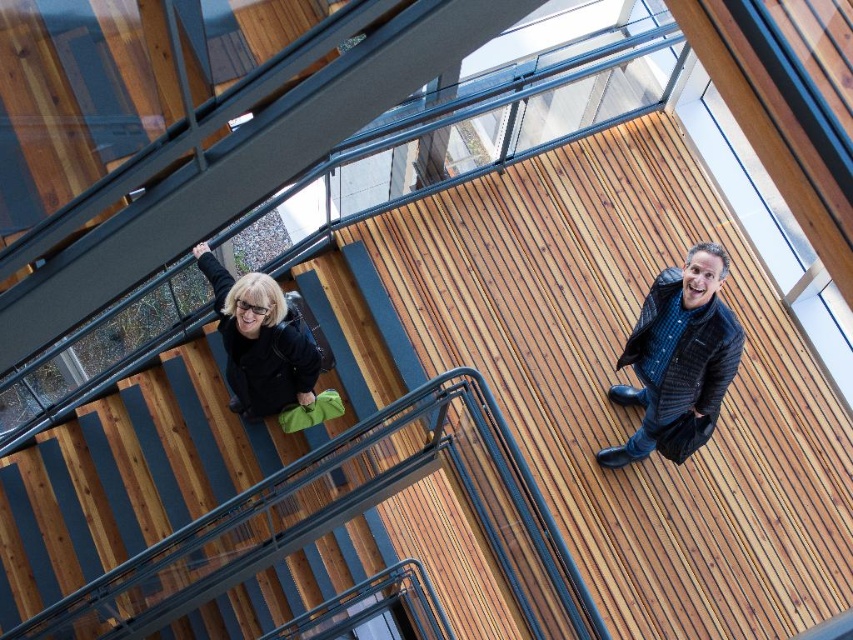
You are an interior designer assessing the space between two jackets in the image. The dark blue textured jacket at upper right and the matte black jacket at center are both on display. Which jacket takes up more horizontal space?

The matte black jacket at center takes up more horizontal space because its width is greater than the dark blue textured jacket at upper right.

You are standing at the bottom of the staircase and want to greet both the dark blue textured jacket at upper right and the matte black jacket at center. Which jacket should you look towards first if you want to greet the person closer to your left side?

The matte black jacket at center is to the left of the dark blue textured jacket at upper right. Since you want to greet the person closer to your left side, you should look towards the matte black jacket at center first.